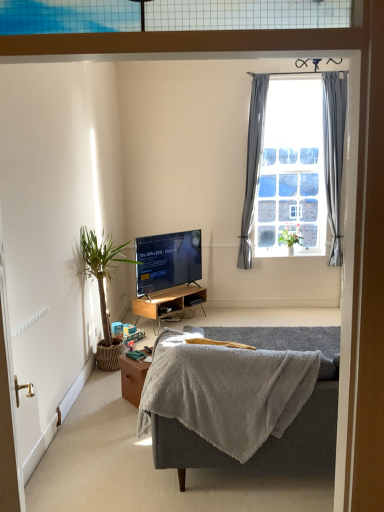
Question: Considering the relative sizes of woodenmaterial/texturedesk at center and green leafy plant at left, the 2th houseplant viewed from the right, in the image provided, is woodenmaterial/texturedesk at center taller than green leafy plant at left, the 2th houseplant viewed from the right,?

Choices:
 (A) yes
 (B) no

Answer: (B)

Question: Can you confirm if woodenmaterial/texturedesk at center is thinner than green leafy plant at left, which appears as the 1th houseplant when viewed from the front?

Choices:
 (A) yes
 (B) no

Answer: (A)

Question: Is the position of woodenmaterial/texturedesk at center less distant than that of green leafy plant at left, the 2th houseplant viewed from the right?

Choices:
 (A) no
 (B) yes

Answer: (A)

Question: From a real-world perspective, is woodenmaterial/texturedesk at center positioned under green leafy plant at left, positioned as the 2th houseplant in back-to-front order, based on gravity?

Choices:
 (A) no
 (B) yes

Answer: (B)

Question: Is woodenmaterial/texturedesk at center next to green leafy plant at left, the 2th houseplant viewed from the right?

Choices:
 (A) no
 (B) yes

Answer: (A)

Question: Can you confirm if woodenmaterial/texturedesk at center is wider than green leafy plant at left, which appears as the 1th houseplant when viewed from the front?

Choices:
 (A) no
 (B) yes

Answer: (A)

Question: Can you confirm if green leafy plant at window, the second houseplant when ordered from front to back, is shorter than gray fabric curtain at upper right, the 1th curtain positioned from the right?

Choices:
 (A) yes
 (B) no

Answer: (A)

Question: Is gray fabric curtain at upper right, which is counted as the second curtain, starting from the left, inside green leafy plant at window, positioned as the first houseplant in back-to-front order?

Choices:
 (A) yes
 (B) no

Answer: (B)

Question: Does green leafy plant at window, which is the 2th houseplant from left to right, have a lesser width compared to gray fabric curtain at upper right, which is counted as the second curtain, starting from the left?

Choices:
 (A) yes
 (B) no

Answer: (B)

Question: Is green leafy plant at window, the first houseplant when ordered from right to left, in contact with gray fabric curtain at upper right, which is counted as the second curtain, starting from the left?

Choices:
 (A) yes
 (B) no

Answer: (B)

Question: Is green leafy plant at window, the first houseplant when ordered from right to left, oriented away from gray fabric curtain at upper right, which is counted as the second curtain, starting from the left?

Choices:
 (A) no
 (B) yes

Answer: (A)

Question: From a real-world perspective, is green leafy plant at window, which is the 2th houseplant from left to right, on gray fabric curtain at upper right, the 1th curtain positioned from the right?

Choices:
 (A) no
 (B) yes

Answer: (A)

Question: Is clear glass window at upper right closer to the viewer compared to green leafy plant at window, which is the 2th houseplant from left to right?

Choices:
 (A) no
 (B) yes

Answer: (B)